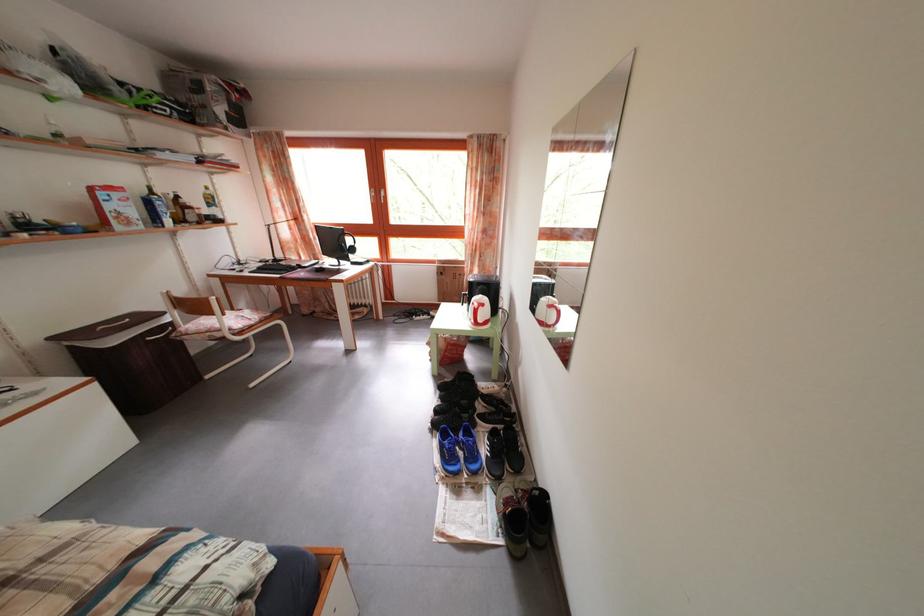
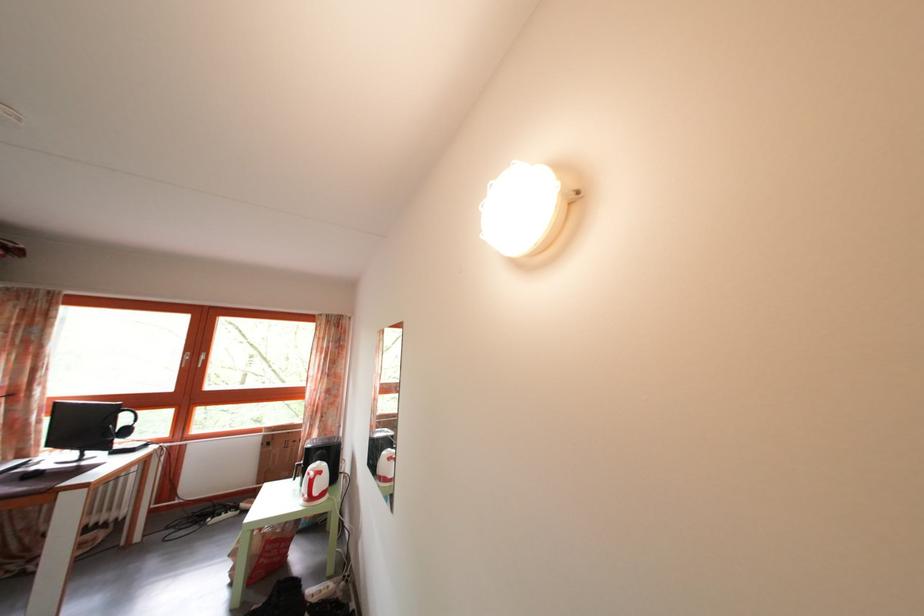
The point at (479, 278) is marked in the first image. Where is the corresponding point in the second image?

(317, 442)